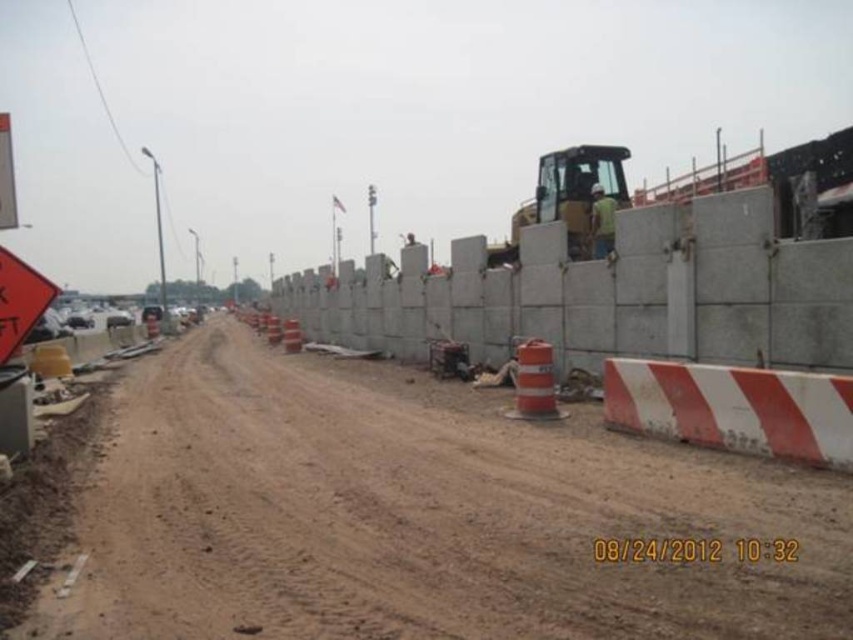
Question: Which point is farther to the camera?

Choices:
 (A) green fabric construction worker at center
 (B) brown dirt track at center

Answer: (A)

Question: Does brown dirt track at center have a smaller size compared to green fabric construction worker at center?

Choices:
 (A) yes
 (B) no

Answer: (B)

Question: Which point is farther to the camera?

Choices:
 (A) (598, 189)
 (B) (97, 595)

Answer: (A)

Question: Does brown dirt track at center have a smaller size compared to green fabric construction worker at center?

Choices:
 (A) yes
 (B) no

Answer: (B)

Question: Does brown dirt track at center appear under green fabric construction worker at center?

Choices:
 (A) yes
 (B) no

Answer: (A)